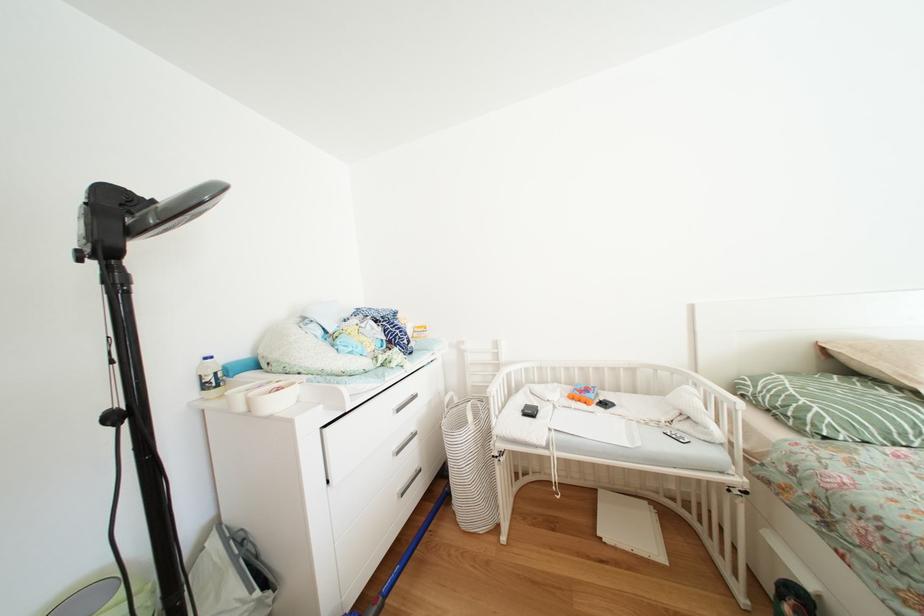
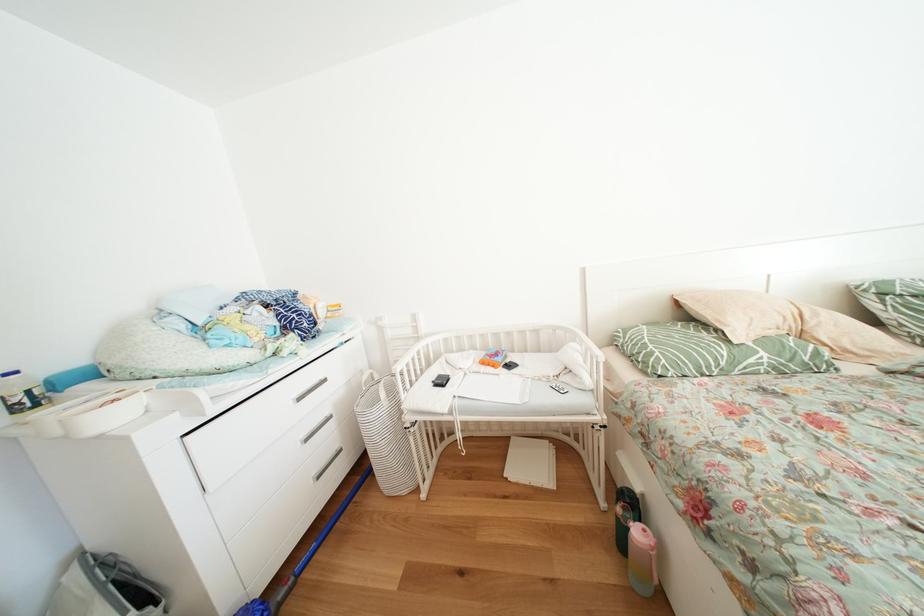
In the second image, find the point that corresponds to (x=215, y=363) in the first image.

(16, 379)